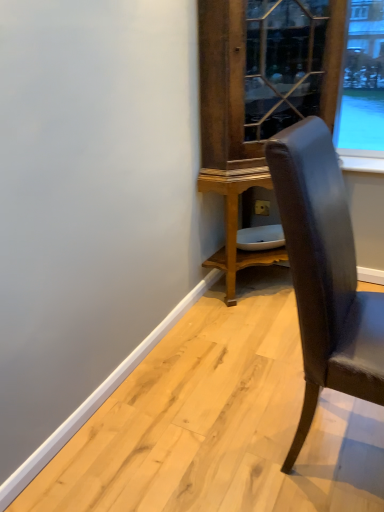
Find the location of a particular element. vacant space in front of wooden glossy dresser at center is located at coordinates (243, 360).